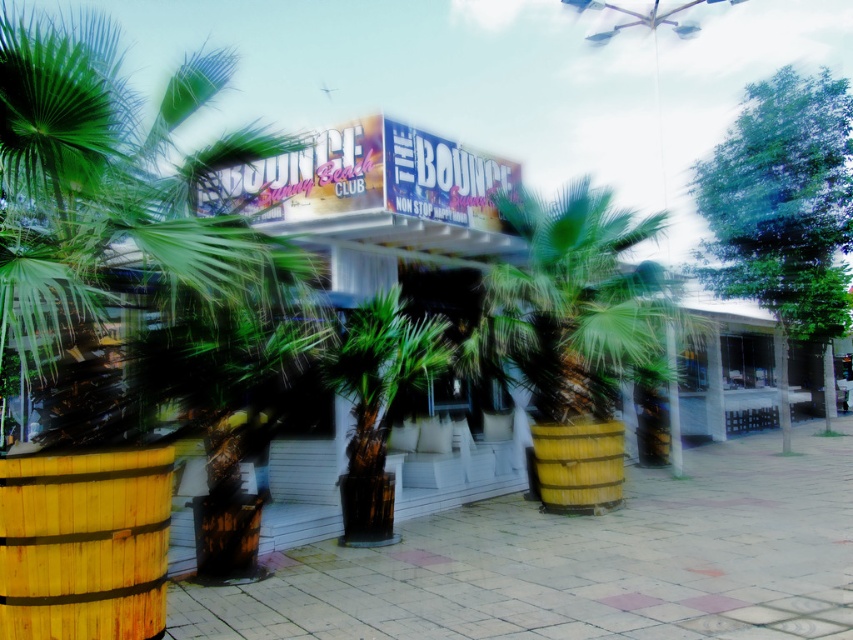
Question: Can you confirm if wooden barrel at lower left is positioned below wooden barrel at center?

Choices:
 (A) no
 (B) yes

Answer: (A)

Question: Can you confirm if green wooden palm tree at center is thinner than wooden barrel at lower left?

Choices:
 (A) yes
 (B) no

Answer: (B)

Question: Considering the relative positions of green wooden palm tree at center and green textured palm tree at center in the image provided, where is green wooden palm tree at center located with respect to green textured palm tree at center?

Choices:
 (A) below
 (B) above

Answer: (B)

Question: Which object is the farthest from the wooden barrel at lower left?

Choices:
 (A) green textured palm tree at center
 (B) green wooden palm tree at center
 (C) wooden barrel at center

Answer: (C)

Question: Among these points, which one is nearest to the camera?

Choices:
 (A) (7, 600)
 (B) (561, 456)
 (C) (363, 516)
 (D) (529, 317)

Answer: (A)

Question: Among these objects, which one is farthest from the camera?

Choices:
 (A) green textured palm tree at center
 (B) wooden barrel at center
 (C) wooden barrel at lower left
 (D) green wooden palm tree at center

Answer: (B)